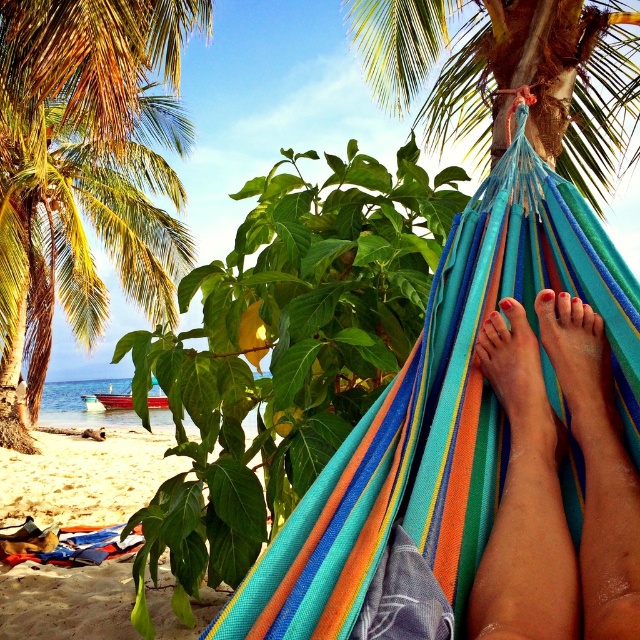
You are standing at the center of the beach scene. There is a multicolored striped hammock at center and a point at coordinates (442, 413). Which object is exactly at the given coordinates?

The multicolored striped hammock at center is located at point (442, 413).

You are standing at the origin point of the coordinate system, which is the bottom left corner of the image. There is a point at coordinate (442, 413). What object is located at that point?

The multicolored striped hammock at center is located at point (442, 413).

You are standing at the edge of the beach looking at the multicolored striped hammock at center and the green leafy palm tree at upper left. Which object is closer to your right side?

The multicolored striped hammock at center is to the right of the green leafy palm tree at upper left, so it is closer to your right side.